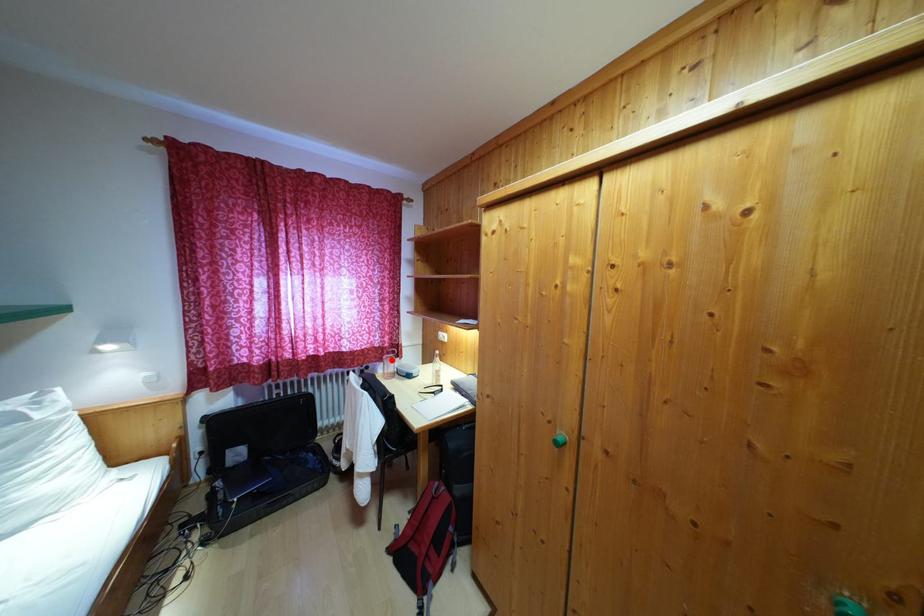
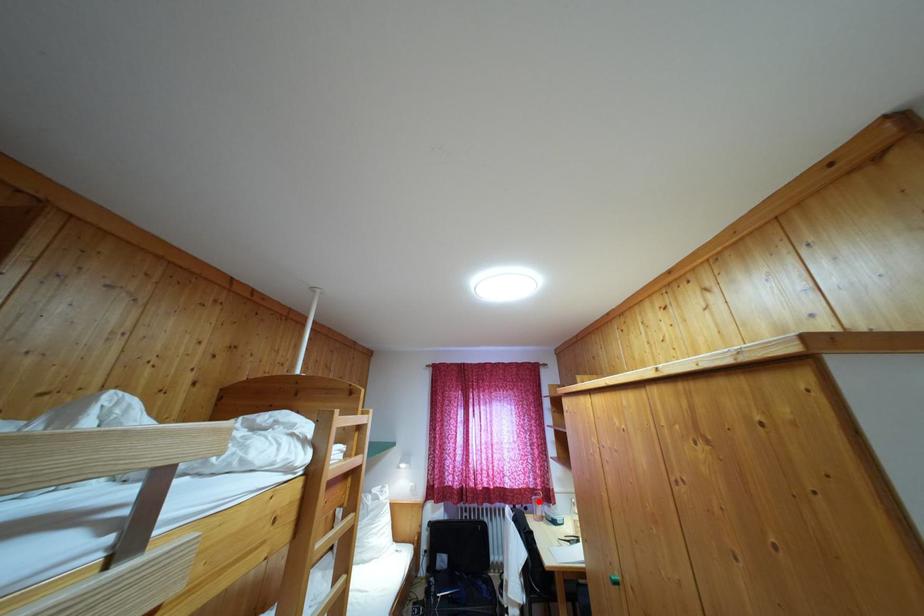
I am providing you with two images of the same scene from different viewpoints. A red point is marked on the first image and another point is marked on the second image. Do the highlighted points in image1 and image2 indicate the same real-world spot?

Yes